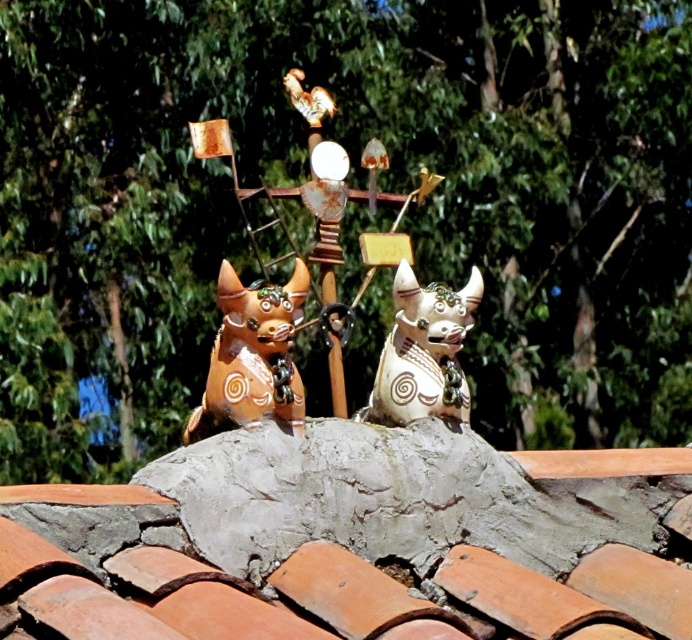
You are an architect designing a new rooftop garden inspired by ancient Mesoamerican art. You have two statues to place on a central platform. The matte orange statue at center and the matte ceramic dog at center. Given their sizes, which statue should be placed at the highest point to maintain visual balance?

A: The matte orange statue at center should be placed at the highest point since it is taller than the matte ceramic dog at center, ensuring visual balance by aligning their heights appropriately.

You are standing on the rooftop and want to place a small statue exactly where the point marked as point (x=355, y=541) is located. According to the scene description, what will the statue be placed on?

The point (x=355, y=541) marks terracotta tiles at center, so the statue will be placed on terracotta tiles at center.